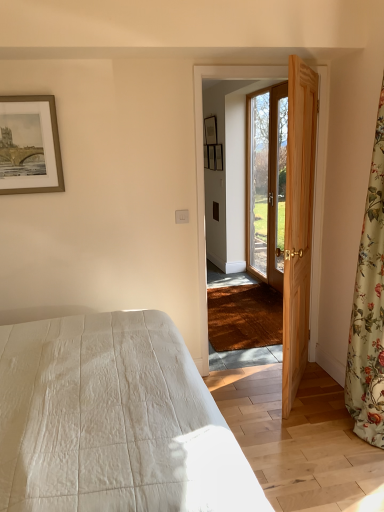
Question: From the image's perspective, would you say natural wood door at right, arranged as the 1th door when viewed from the front, is positioned over matte black picture frame at upper center, the third picture frame in the right-to-left sequence?

Choices:
 (A) no
 (B) yes

Answer: (A)

Question: Can you confirm if natural wood door at right, the second door viewed from the back, is smaller than matte black picture frame at upper center, the third picture frame in the right-to-left sequence?

Choices:
 (A) no
 (B) yes

Answer: (A)

Question: Could you tell me if natural wood door at right, the second door viewed from the back, is turned towards matte black picture frame at upper center, acting as the fourth picture frame starting from the bottom?

Choices:
 (A) no
 (B) yes

Answer: (A)

Question: Would you say natural wood door at right, arranged as the 1th door when viewed from the front, contains matte black picture frame at upper center, acting as the fourth picture frame starting from the bottom?

Choices:
 (A) yes
 (B) no

Answer: (B)

Question: Is natural wood door at right, arranged as the 1th door when viewed from the front, in front of matte black picture frame at upper center, which is the 2th picture frame from back to front?

Choices:
 (A) yes
 (B) no

Answer: (A)

Question: Is the position of natural wood door at right, arranged as the 1th door when viewed from the front, more distant than that of matte black picture frame at upper center, acting as the second picture frame starting from the left?

Choices:
 (A) yes
 (B) no

Answer: (B)

Question: Could you tell me if gold-framed artwork at upper left, arranged as the 1th picture frame when viewed from the left, is turned towards natural wood door at right, the second door viewed from the back?

Choices:
 (A) yes
 (B) no

Answer: (B)

Question: Are gold-framed artwork at upper left, arranged as the first picture frame when ordered from the bottom, and natural wood door at right, arranged as the 1th door when viewed from the front, far apart?

Choices:
 (A) yes
 (B) no

Answer: (A)

Question: Is the position of gold-framed artwork at upper left, arranged as the 1th picture frame when viewed from the left, less distant than that of natural wood door at right, arranged as the 1th door when viewed from the front?

Choices:
 (A) no
 (B) yes

Answer: (A)

Question: Considering the relative positions of gold-framed artwork at upper left, which ranks as the 4th picture frame in right-to-left order, and natural wood door at right, arranged as the 1th door when viewed from the front, in the image provided, is gold-framed artwork at upper left, which ranks as the 4th picture frame in right-to-left order, to the right of natural wood door at right, arranged as the 1th door when viewed from the front, from the viewer's perspective?

Choices:
 (A) yes
 (B) no

Answer: (B)

Question: From the image's perspective, is gold-framed artwork at upper left, the 1th picture frame when ordered from front to back, over natural wood door at right, arranged as the 1th door when viewed from the front?

Choices:
 (A) no
 (B) yes

Answer: (B)

Question: Can you confirm if gold-framed artwork at upper left, which appears as the 4th picture frame when viewed from the top, is smaller than natural wood door at right, the second door viewed from the back?

Choices:
 (A) yes
 (B) no

Answer: (A)

Question: From a real-world perspective, is white quilted bed at lower left on wooden picture frame at center, which ranks as the 4th picture frame in front-to-back order?

Choices:
 (A) yes
 (B) no

Answer: (B)